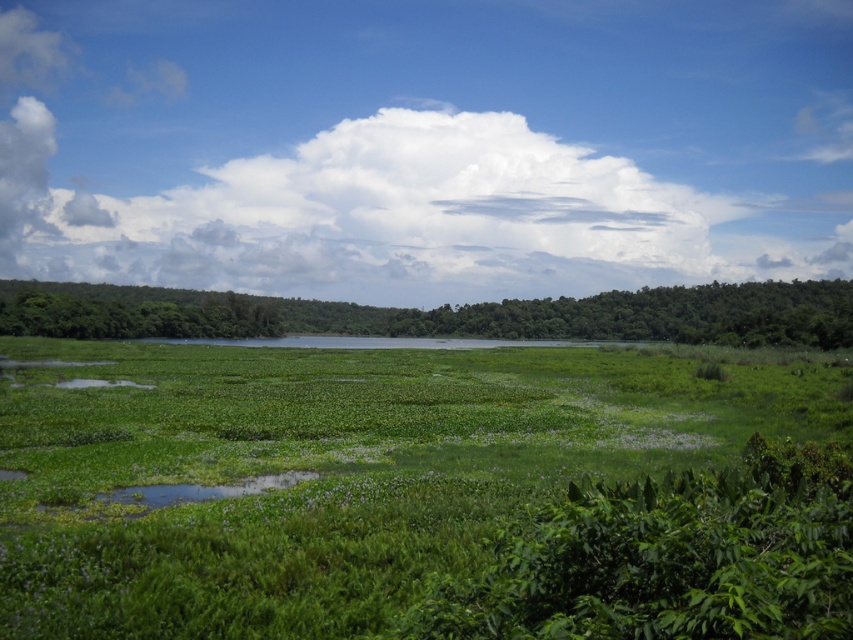
Based on the scene description, where is the green leafy grass at center located in terms of its 2D coordinates?

The green leafy grass at center is located at the 2D coordinates of point (x=416, y=493).

In the scene shown: You are standing in the middle of the scene and want to walk towards the green leafy tree at center. Which direction should you walk to avoid the green leafy grass at center?

Since the green leafy grass at center occupies less space than the green leafy tree at center, you should walk towards the direction of the green leafy tree at center to avoid the smaller area of green leafy grass at center.

You are standing at the edge of the water and see the green leafy grass at center and the green leafy tree at center. Which one is closer to your left side?

The green leafy grass at center is to the left of the green leafy tree at center, so it is closer to your left side.